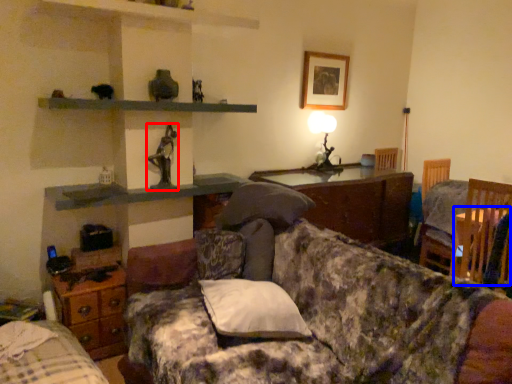
Question: Which object appears closest to the camera in this image, person (highlighted by a red box) or table (highlighted by a blue box)?

Choices:
 (A) person
 (B) table

Answer: (B)